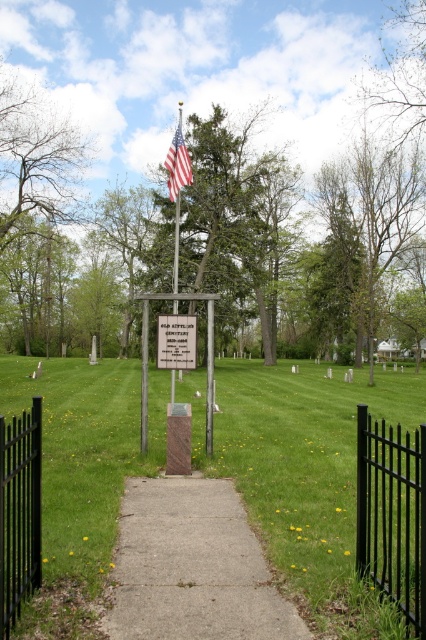
Question: In this image, where is green grass at center located relative to polished metal flag pole at center?

Choices:
 (A) below
 (B) above

Answer: (A)

Question: Which of the following is the farthest from the observer?

Choices:
 (A) american flag at center
 (B) black metal fence at left
 (C) green leafy tree at upper center
 (D) concrete at center

Answer: (C)

Question: Can you confirm if green grass at center is thinner than green leafy tree at upper left?

Choices:
 (A) no
 (B) yes

Answer: (A)

Question: Does green leafy tree at center appear on the right side of white plastic sign at center?

Choices:
 (A) yes
 (B) no

Answer: (A)

Question: Which point is farther to the camera?

Choices:
 (A) concrete at center
 (B) green grass at center
 (C) green leafy tree at upper center
 (D) american flag at center

Answer: (C)

Question: Which object appears farthest from the camera in this image?

Choices:
 (A) american flag at center
 (B) concrete at center

Answer: (A)